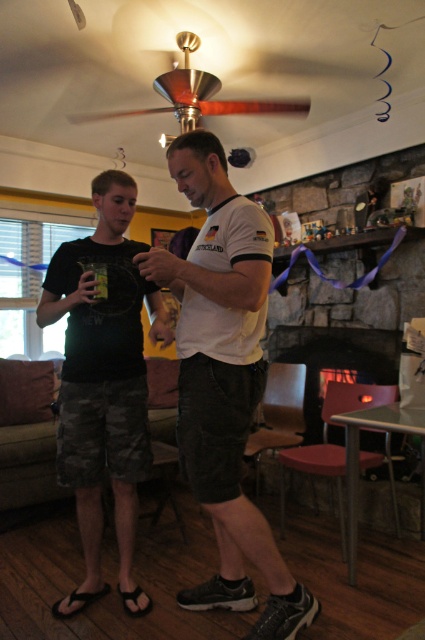
Is the position of white cotton t-shirt at center more distant than that of wooden ceiling fan at upper center?

No, it is in front of wooden ceiling fan at upper center.

Is white cotton t-shirt at center to the left of wooden ceiling fan at upper center from the viewer's perspective?

No, white cotton t-shirt at center is not to the left of wooden ceiling fan at upper center.

You are a GUI agent. You are given a task and a screenshot of the screen. Output one action in this format:
    pyautogui.click(x=<x>, y=<y>)
    Task: Click on the white cotton t-shirt at center
    This screenshot has width=425, height=640.
    Given the screenshot: What is the action you would take?
    pyautogui.click(x=224, y=380)

Which is in front, point (79, 604) or point (124, 112)?

Positioned in front is point (79, 604).

Does camouflage shorts at center have a greater height compared to wooden ceiling fan at upper center?

Indeed, camouflage shorts at center has a greater height compared to wooden ceiling fan at upper center.

The image size is (425, 640). I want to click on camouflage shorts at center, so click(104, 381).

Between white cotton t-shirt at center and dark stone fireplace at center, which one has less height?

dark stone fireplace at center

Is white cotton t-shirt at center to the left of dark stone fireplace at center from the viewer's perspective?

Yes, white cotton t-shirt at center is to the left of dark stone fireplace at center.

This screenshot has width=425, height=640. I want to click on white cotton t-shirt at center, so click(224, 380).